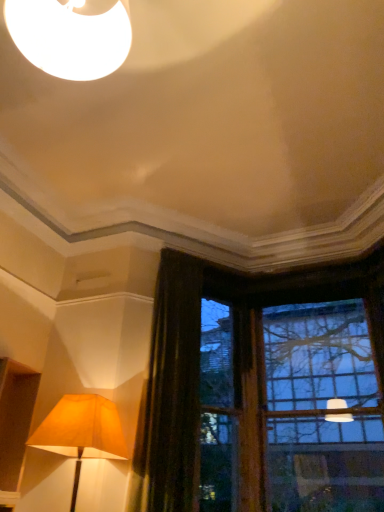
Question: From the image's perspective, does matte gold lampshade at lower left appear higher than clear glass window at upper right?

Choices:
 (A) yes
 (B) no

Answer: (B)

Question: Is matte gold lampshade at lower left looking in the opposite direction of clear glass window at upper right?

Choices:
 (A) no
 (B) yes

Answer: (A)

Question: From a real-world perspective, is matte gold lampshade at lower left under clear glass window at upper right?

Choices:
 (A) yes
 (B) no

Answer: (A)

Question: Can you confirm if matte gold lampshade at lower left is taller than clear glass window at upper right?

Choices:
 (A) no
 (B) yes

Answer: (A)

Question: Is matte gold lampshade at lower left aimed at clear glass window at upper right?

Choices:
 (A) yes
 (B) no

Answer: (B)

Question: From the image's perspective, is matte gold lampshade at lower left positioned above or below clear glass window at upper right?

Choices:
 (A) below
 (B) above

Answer: (A)

Question: Is point (87, 413) closer or farther from the camera than point (367, 400)?

Choices:
 (A) farther
 (B) closer

Answer: (B)

Question: Considering their positions, is matte gold lampshade at lower left located in front of or behind clear glass window at upper right?

Choices:
 (A) behind
 (B) front

Answer: (B)

Question: Is matte gold lampshade at lower left inside the boundaries of clear glass window at upper right, or outside?

Choices:
 (A) outside
 (B) inside

Answer: (A)

Question: From the image's perspective, relative to clear glass window at upper right, is dark brown velvet curtain at left above or below?

Choices:
 (A) below
 (B) above

Answer: (B)

Question: From a real-world perspective, is dark brown velvet curtain at left physically located above or below clear glass window at upper right?

Choices:
 (A) below
 (B) above

Answer: (A)

Question: Is dark brown velvet curtain at left wider or thinner than clear glass window at upper right?

Choices:
 (A) wide
 (B) thin

Answer: (B)

Question: Based on their sizes in the image, would you say dark brown velvet curtain at left is bigger or smaller than clear glass window at upper right?

Choices:
 (A) big
 (B) small

Answer: (B)

Question: Is clear glass window at upper right taller or shorter than dark brown velvet curtain at left?

Choices:
 (A) tall
 (B) short

Answer: (A)

Question: From a real-world perspective, is clear glass window at upper right positioned above or below dark brown velvet curtain at left?

Choices:
 (A) above
 (B) below

Answer: (A)